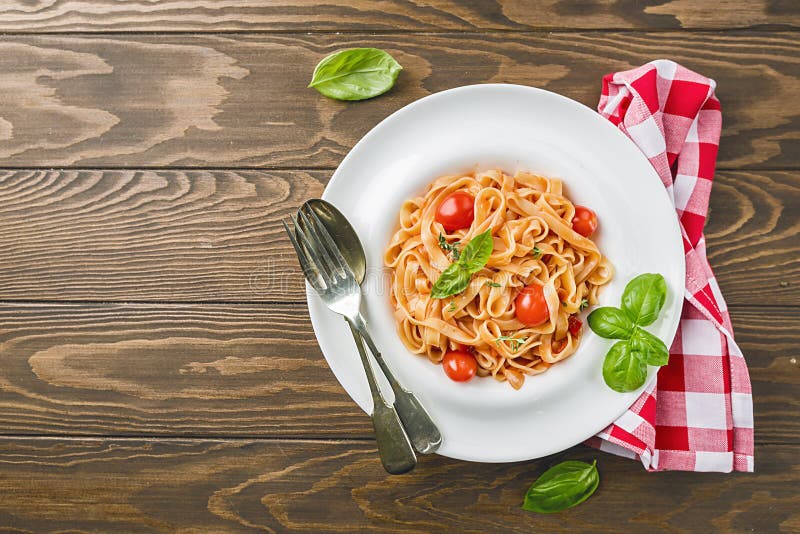
Identify the location of leaves on table. (576, 486), (370, 77).